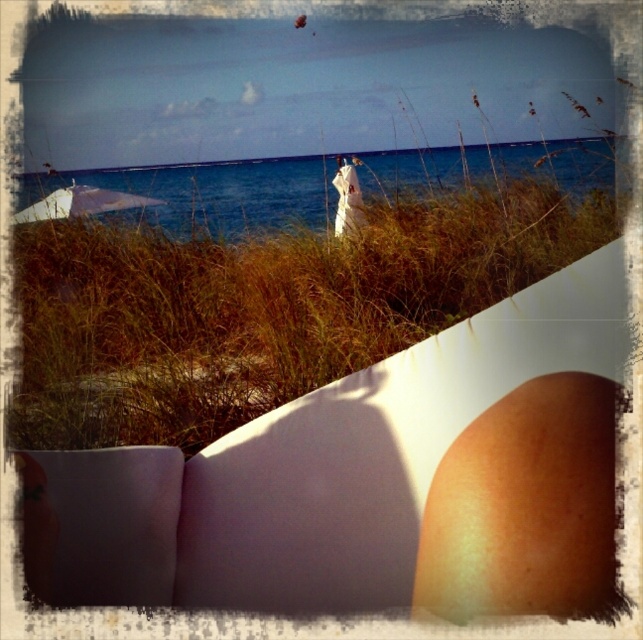
Based on the coordinates provided in the scene description, where exactly is the brown grass at center located?

The brown grass at center is located at point coordinates of (260, 307).